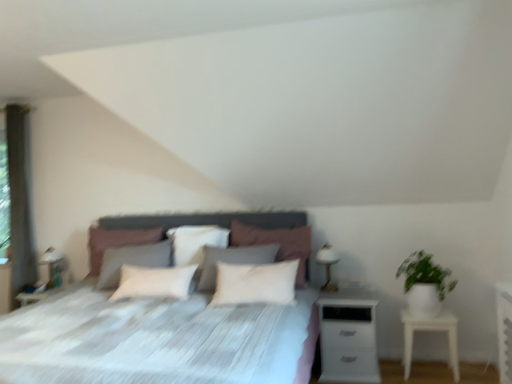
Question: From a real-world perspective, is gray fabric curtain at left positioned above or below green matte plant at right?

Choices:
 (A) above
 (B) below

Answer: (A)

Question: Visually, is gray fabric curtain at left positioned to the left or to the right of green matte plant at right?

Choices:
 (A) left
 (B) right

Answer: (A)

Question: Which object is positioned farthest from the white matte nightstand at right, arranged as the second nightstand when viewed from the left?

Choices:
 (A) white soft pillow at center, acting as the 3th pillow starting from the right
 (B) white glossy table lamp at right, which is counted as the second table lamp, starting from the left
 (C) white soft pillow at center, positioned as the second pillow in left-to-right order
 (D) white matte nightstand at right, marked as the second nightstand in a right-to-left arrangement
 (E) green matte plant at right

Answer: (A)

Question: Which object is positioned closest to the white matte nightstand at right, acting as the 1th nightstand starting from the left?

Choices:
 (A) gray fabric curtain at left
 (B) white fabric bed at center
 (C) green matte plant at right
 (D) white soft pillow at center, the first pillow in the left-to-right sequence
 (E) white glossy table lamp at left, the 1th table lamp in the back-to-front sequence

Answer: (C)